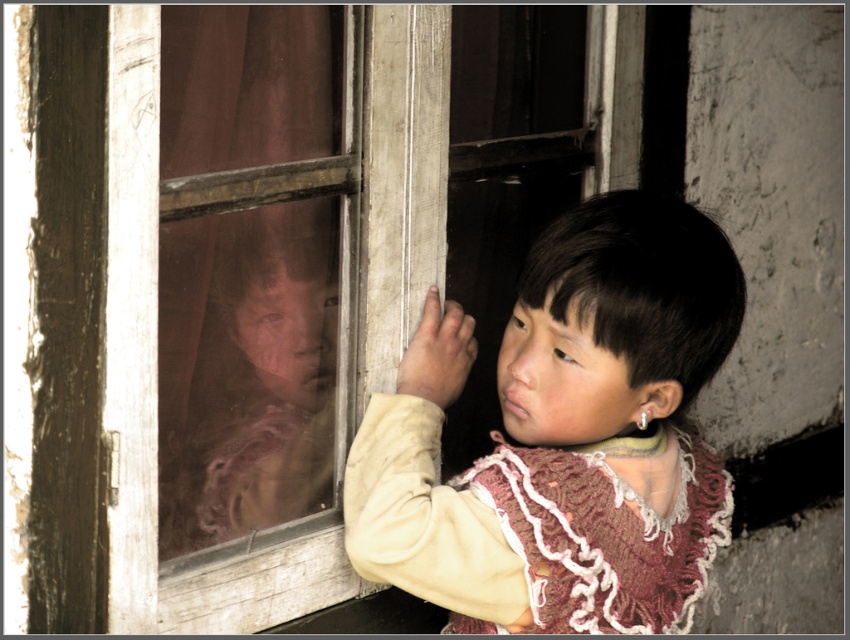
Question: Which object is positioned farthest from the brown fabric curtain at left?

Choices:
 (A) wooden frame at center
 (B) light beige sweater at center

Answer: (B)

Question: Can you confirm if light beige sweater at center is bigger than brown fabric curtain at left?

Choices:
 (A) yes
 (B) no

Answer: (A)

Question: Which object is farther from the camera taking this photo?

Choices:
 (A) light beige sweater at center
 (B) wooden frame at center

Answer: (A)

Question: Is wooden frame at center in front of light beige sweater at center?

Choices:
 (A) yes
 (B) no

Answer: (A)

Question: Does wooden frame at center appear over light beige sweater at center?

Choices:
 (A) no
 (B) yes

Answer: (B)

Question: Estimate the real-world distances between objects in this image. Which object is closer to the light beige sweater at center?

Choices:
 (A) brown fabric curtain at left
 (B) wooden frame at center

Answer: (B)